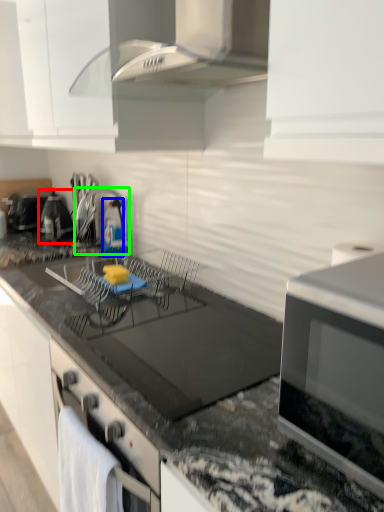
Question: Which object is positioned closest to appliance (highlighted by a red box)? Select from bottle (highlighted by a blue box) and appliance (highlighted by a green box).

Choices:
 (A) bottle
 (B) appliance

Answer: (B)